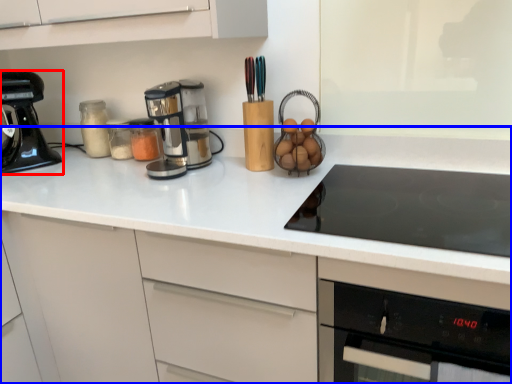
Question: Among these objects, which one is nearest to the camera, kitchen appliance (highlighted by a red box) or countertop (highlighted by a blue box)?

Choices:
 (A) kitchen appliance
 (B) countertop

Answer: (B)